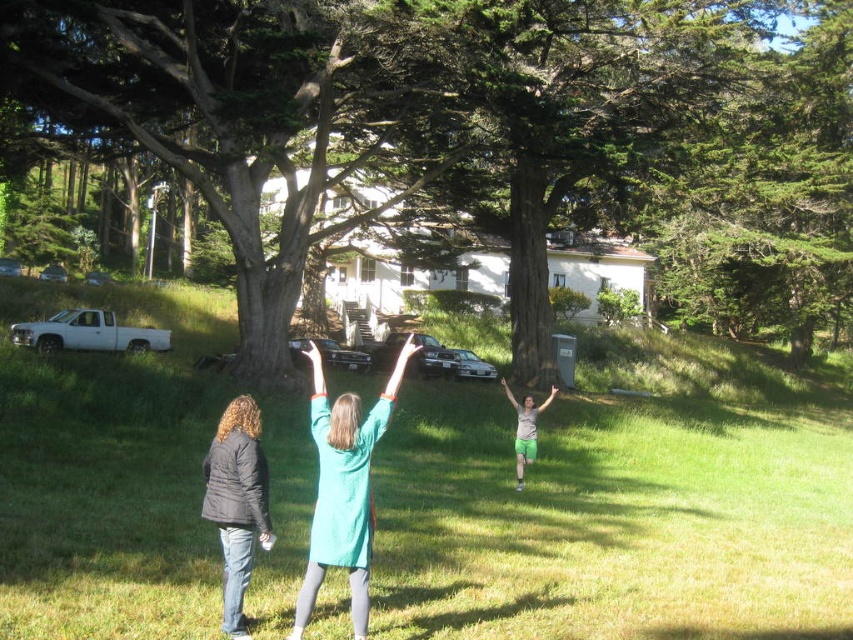
Image resolution: width=853 pixels, height=640 pixels. Find the location of `green grass at center`. green grass at center is located at coordinates (613, 518).

Which is more to the left, green grass at center or green fabric pants at center?

green fabric pants at center

Is point (74, 582) farther from viewer compared to point (520, 410)?

No.

Identify the location of green grass at center. This screenshot has width=853, height=640. (613, 518).

Can you confirm if green grass at center is shorter than black puffy jacket at lower left?

In fact, green grass at center may be taller than black puffy jacket at lower left.

I want to click on green grass at center, so click(613, 518).

Is point (480, 394) closer to camera compared to point (231, 435)?

No.

This screenshot has width=853, height=640. In order to click on green grass at center in this screenshot , I will do `click(613, 518)`.

Who is positioned more to the right, green grass at center or green textured tree at center?

green grass at center is more to the right.

Does point (438, 422) lie in front of point (392, 77)?

Yes, point (438, 422) is in front of point (392, 77).

Locate an element on the screen. The height and width of the screenshot is (640, 853). green grass at center is located at coordinates (613, 518).

The width and height of the screenshot is (853, 640). Identify the location of green grass at center. tap(613, 518).